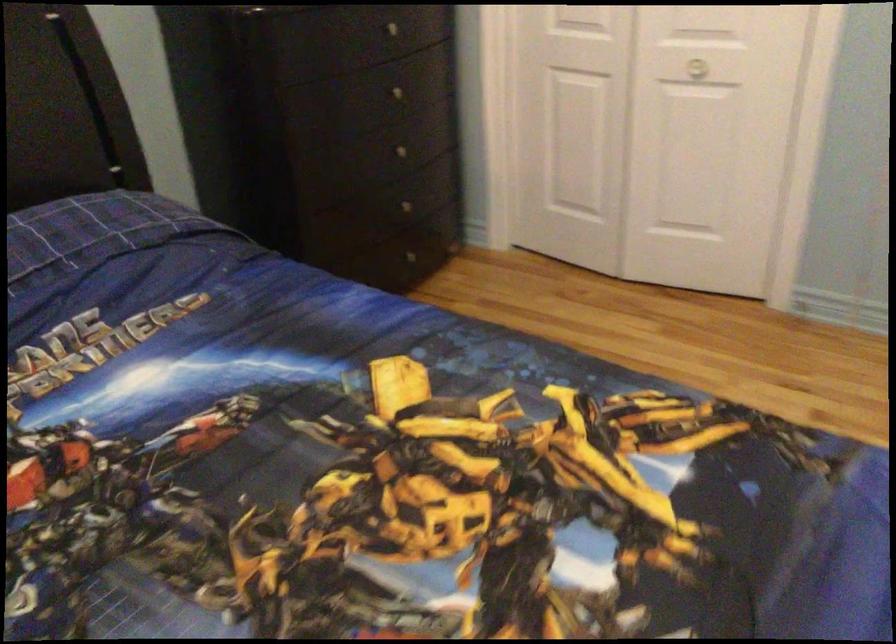
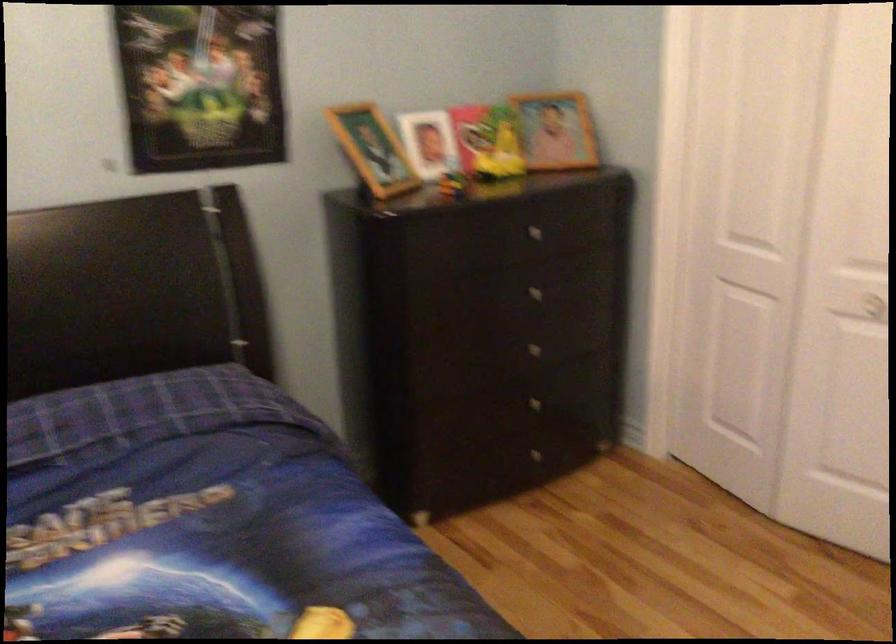
Locate, in the second image, the point that corresponds to (401,209) in the first image.

(528, 406)